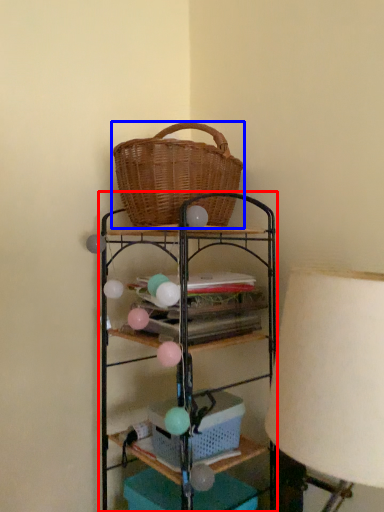
Question: Which object is further to the camera taking this photo, shelf (highlighted by a red box) or picnic basket (highlighted by a blue box)?

Choices:
 (A) shelf
 (B) picnic basket

Answer: (B)